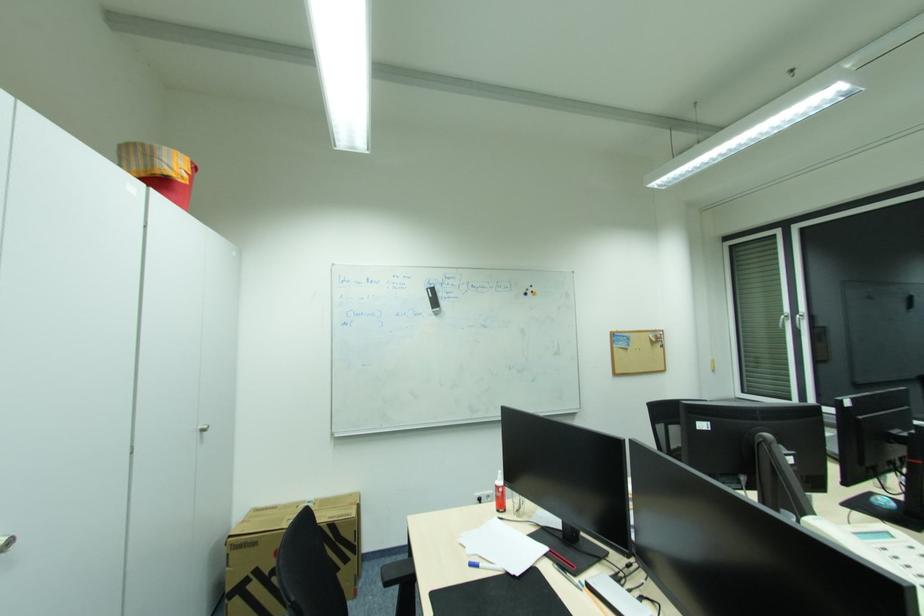
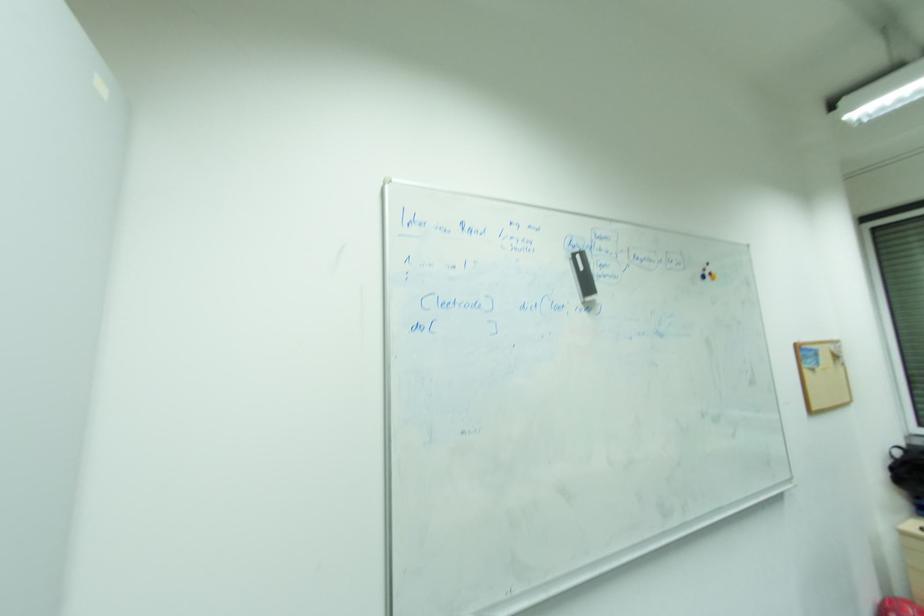
The images are taken continuously from a first-person perspective. In which direction are you moving?

The cameraman walked toward left, forward.